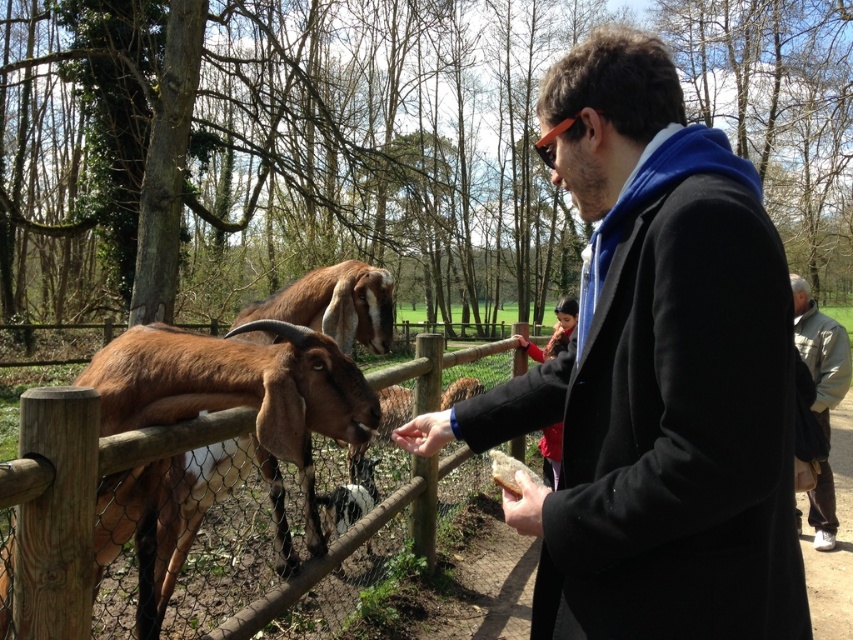
Question: Which point appears farthest from the camera in this image?

Choices:
 (A) (735, 376)
 (B) (514, 508)
 (C) (811, 524)

Answer: (C)

Question: From the image, what is the correct spatial relationship of wooden fence at left in relation to light gray jacket at right?

Choices:
 (A) above
 (B) below

Answer: (A)

Question: Which point appears farthest from the camera in this image?

Choices:
 (A) (822, 422)
 (B) (343, 291)
 (C) (636, 115)

Answer: (A)

Question: Which is nearer to the light gray jacket at right?

Choices:
 (A) smooth brown leather hand at lower center
 (B) wooden fence at left

Answer: (A)

Question: Does brown fuzzy goat at center appear on the right side of smooth brown leather hand at lower center?

Choices:
 (A) yes
 (B) no

Answer: (B)

Question: Is black wool coat at center below smooth brown leather hand at lower center?

Choices:
 (A) no
 (B) yes

Answer: (A)